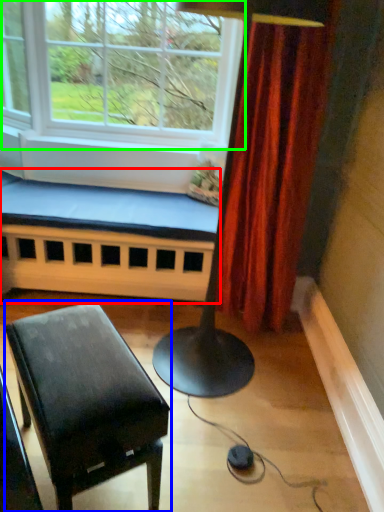
Question: Which is farther away from church bench (highlighted by a red box)? table (highlighted by a blue box) or window (highlighted by a green box)?

Choices:
 (A) table
 (B) window

Answer: (A)